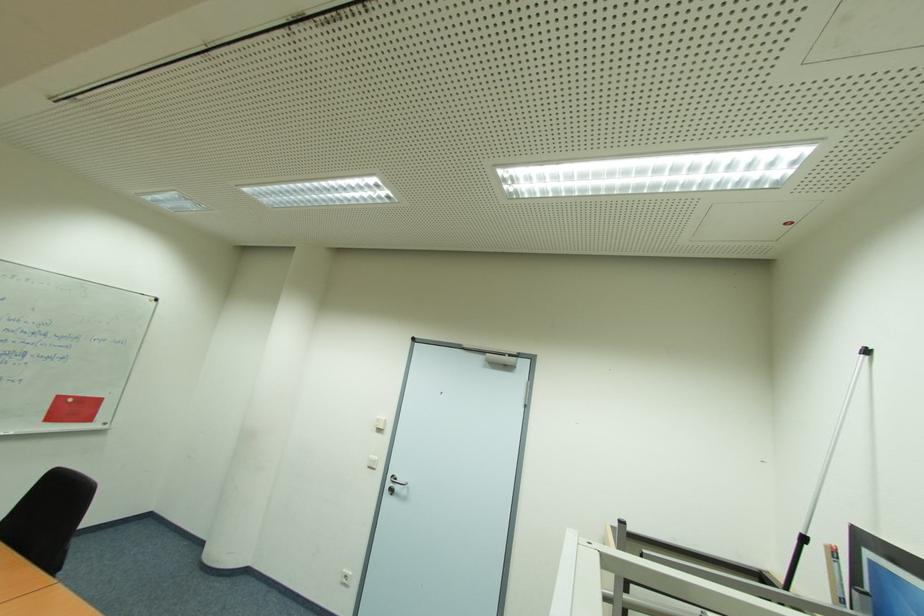
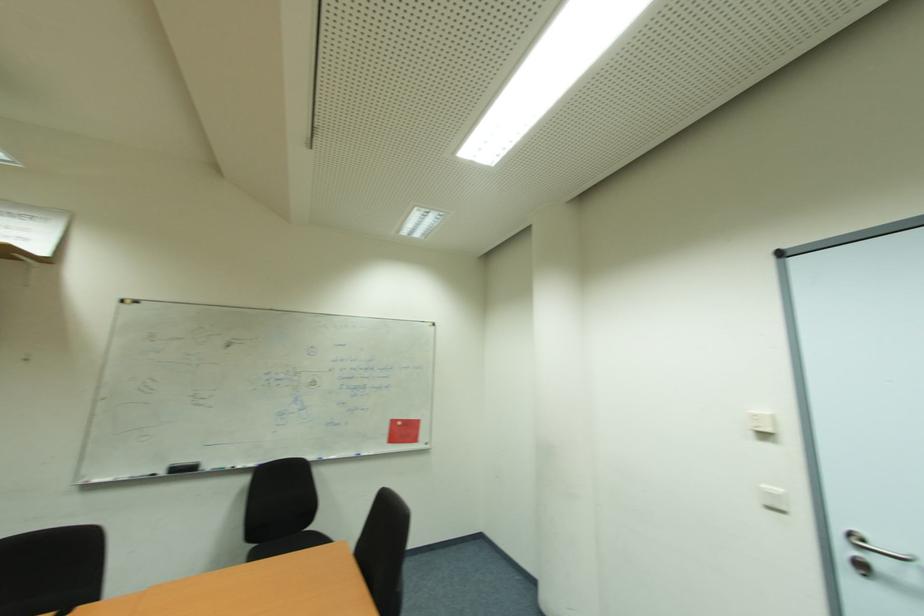
Find the pixel in the second image that matches point 65,399 in the first image.

(397, 423)